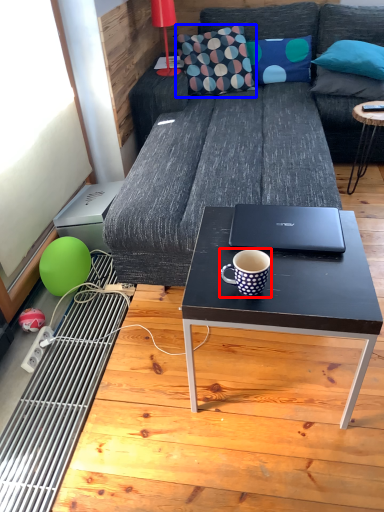
Question: Among these objects, which one is farthest to the camera, coffee cup (highlighted by a red box) or throw pillow (highlighted by a blue box)?

Choices:
 (A) coffee cup
 (B) throw pillow

Answer: (B)